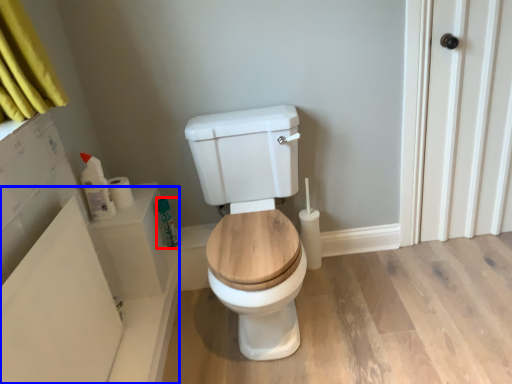
Question: Which object appears farthest to the camera in this image, toiletry (highlighted by a red box) or bath (highlighted by a blue box)?

Choices:
 (A) toiletry
 (B) bath

Answer: (A)